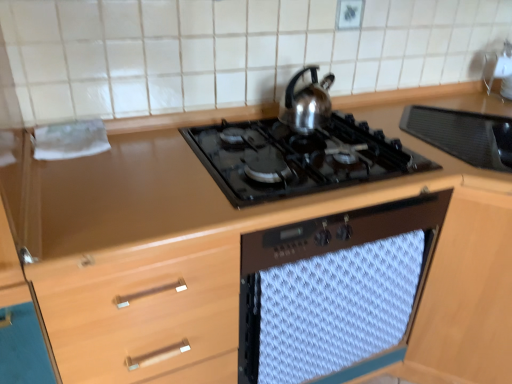
Question: From a real-world perspective, is satin silver kettle at upper center located beneath black glass gas stove at center?

Choices:
 (A) yes
 (B) no

Answer: (B)

Question: Is satin silver kettle at upper center closer to the viewer compared to black glass gas stove at center?

Choices:
 (A) no
 (B) yes

Answer: (A)

Question: Does satin silver kettle at upper center turn towards black glass gas stove at center?

Choices:
 (A) yes
 (B) no

Answer: (B)

Question: Are satin silver kettle at upper center and black glass gas stove at center located far from each other?

Choices:
 (A) no
 (B) yes

Answer: (A)

Question: Does satin silver kettle at upper center have a greater width compared to black glass gas stove at center?

Choices:
 (A) yes
 (B) no

Answer: (B)

Question: Is point (334, 153) closer or farther from the camera than point (331, 226)?

Choices:
 (A) closer
 (B) farther

Answer: (B)

Question: Considering the relative positions of black glass gas stove at center and white textured towel at center in the image provided, is black glass gas stove at center to the left or to the right of white textured towel at center?

Choices:
 (A) right
 (B) left

Answer: (B)

Question: Relative to white textured towel at center, is black glass gas stove at center in front or behind?

Choices:
 (A) front
 (B) behind

Answer: (A)

Question: Based on their sizes in the image, would you say black glass gas stove at center is bigger or smaller than white textured towel at center?

Choices:
 (A) big
 (B) small

Answer: (A)

Question: Does point (413, 170) appear closer or farther from the camera than point (297, 72)?

Choices:
 (A) closer
 (B) farther

Answer: (A)

Question: In terms of size, does black glass gas stove at center appear bigger or smaller than satin silver kettle at upper center?

Choices:
 (A) big
 (B) small

Answer: (A)

Question: From the image's perspective, relative to satin silver kettle at upper center, is black glass gas stove at center above or below?

Choices:
 (A) above
 (B) below

Answer: (B)

Question: Considering the relative positions of black glass gas stove at center and satin silver kettle at upper center in the image provided, is black glass gas stove at center to the left or to the right of satin silver kettle at upper center?

Choices:
 (A) left
 (B) right

Answer: (A)

Question: Based on their sizes in the image, would you say satin silver kettle at upper center is bigger or smaller than white textured towel at center?

Choices:
 (A) small
 (B) big

Answer: (A)

Question: From the image's perspective, relative to white textured towel at center, is satin silver kettle at upper center above or below?

Choices:
 (A) below
 (B) above

Answer: (B)